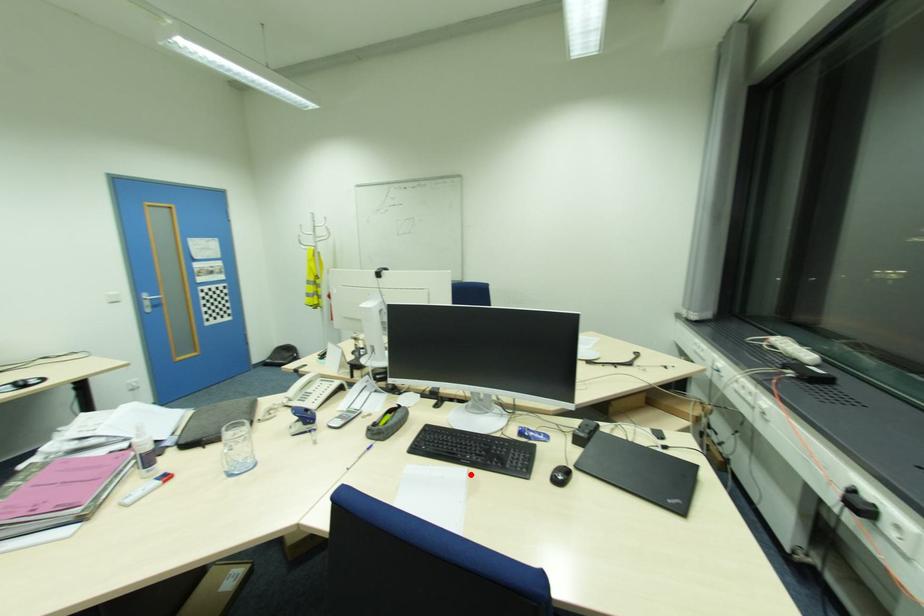
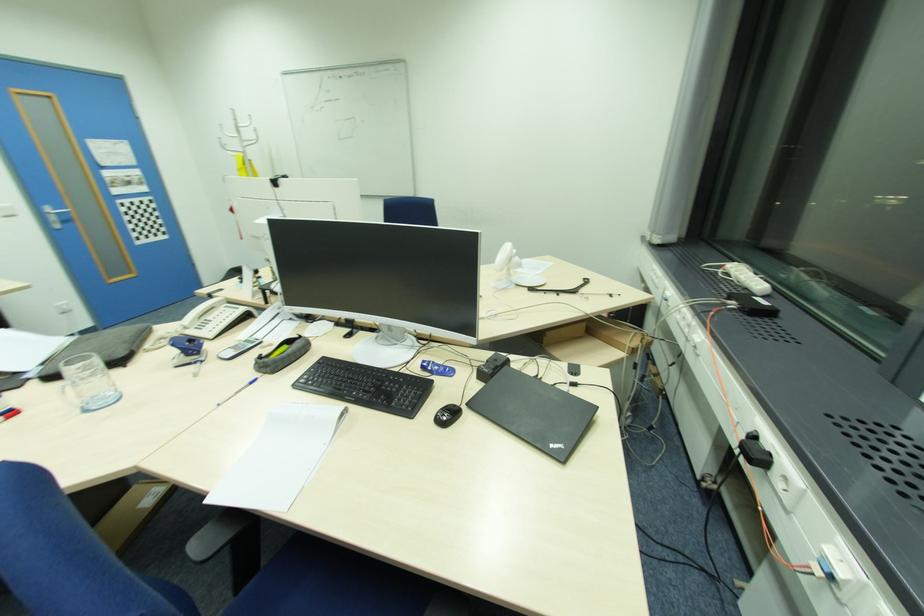
The point at the highlighted location is marked in the first image. Where is the corresponding point in the second image?

(345, 415)